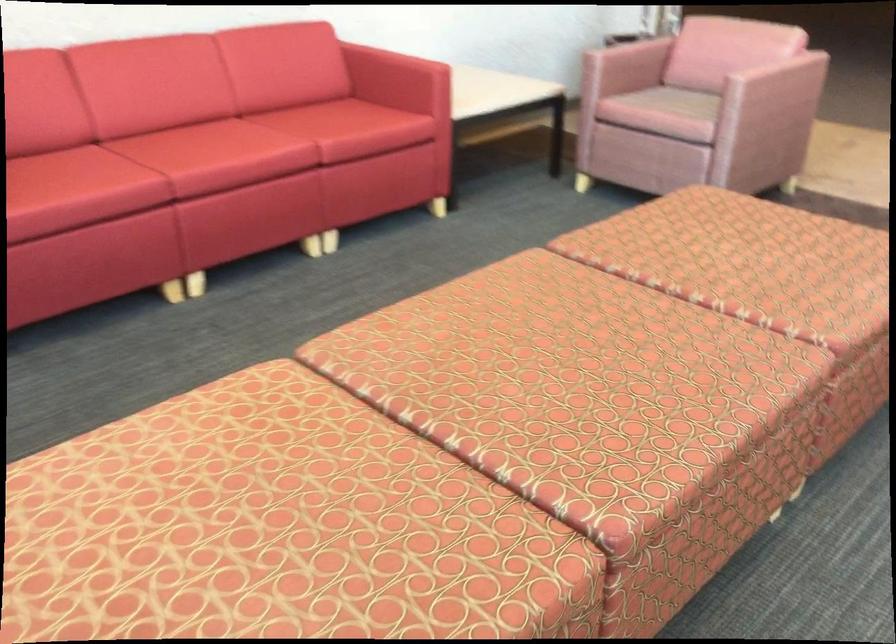
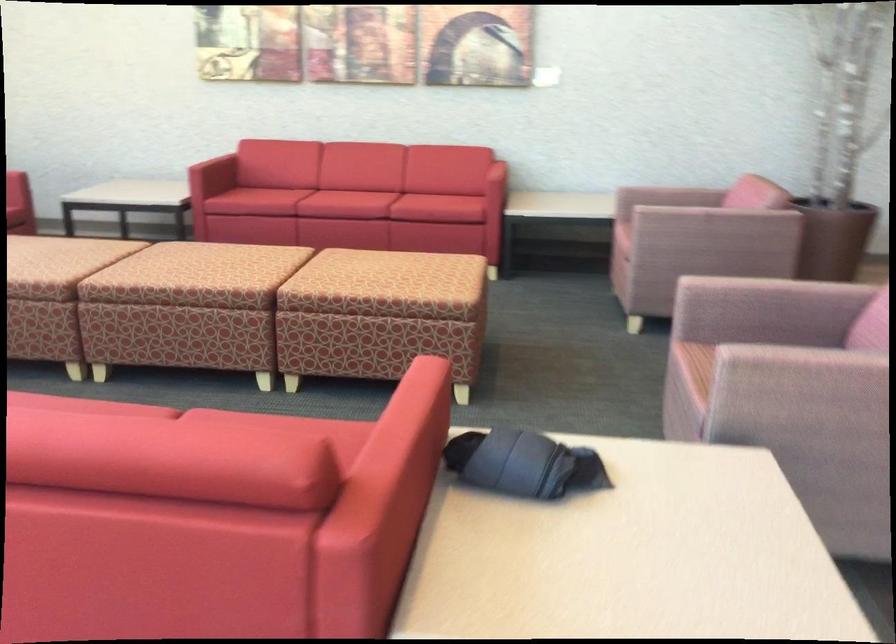
The point at (x=445, y=84) is marked in the first image. Where is the corresponding point in the second image?

(490, 173)